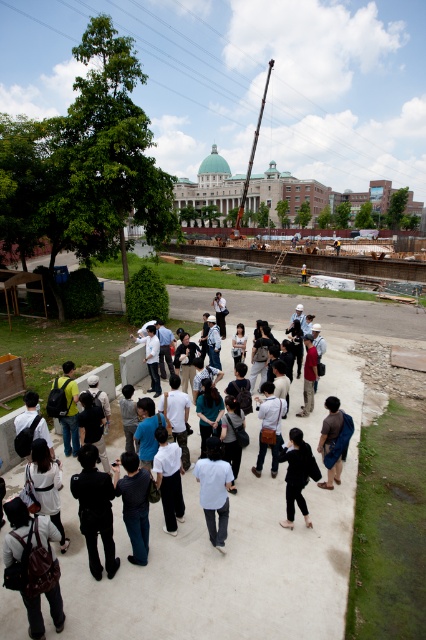
Can you confirm if white concrete pavement at center is wider than brown fabric shirt at center?

Indeed, white concrete pavement at center has a greater width compared to brown fabric shirt at center.

What do you see at coordinates (230, 547) in the screenshot? This screenshot has height=640, width=426. I see `white concrete pavement at center` at bounding box center [230, 547].

Who is more distant from viewer, (319, 576) or (336, 470)?

The point (336, 470) is more distant.

Where is `white concrete pavement at center`? white concrete pavement at center is located at coordinates (230, 547).

Is white concrete pavement at center thinner than matte brown backpack at lower left?

In fact, white concrete pavement at center might be wider than matte brown backpack at lower left.

Is point (348, 451) closer to viewer compared to point (36, 576)?

No, (348, 451) is further to viewer.

You are a GUI agent. You are given a task and a screenshot of the screen. Output one action in this format:
    pyautogui.click(x=<x>, y=<y>)
    Task: Click on the white concrete pavement at center
    
    Given the screenshot: What is the action you would take?
    click(x=230, y=547)

Is point (319, 632) positioned before point (210, 520)?

Yes.

Between point (158, 630) and point (221, 540), which one is positioned behind?

Point (221, 540)

What are the coordinates of `white concrete pavement at center` in the screenshot? It's located at (230, 547).